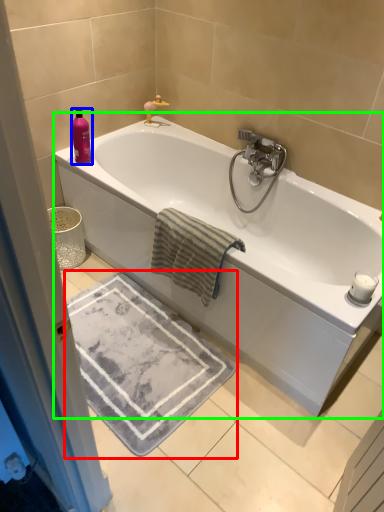
Question: Estimate the real-world distances between objects in this image. Which object is farther from bath mat (highlighted by a red box), toiletry (highlighted by a blue box) or bathtub (highlighted by a green box)?

Choices:
 (A) toiletry
 (B) bathtub

Answer: (A)